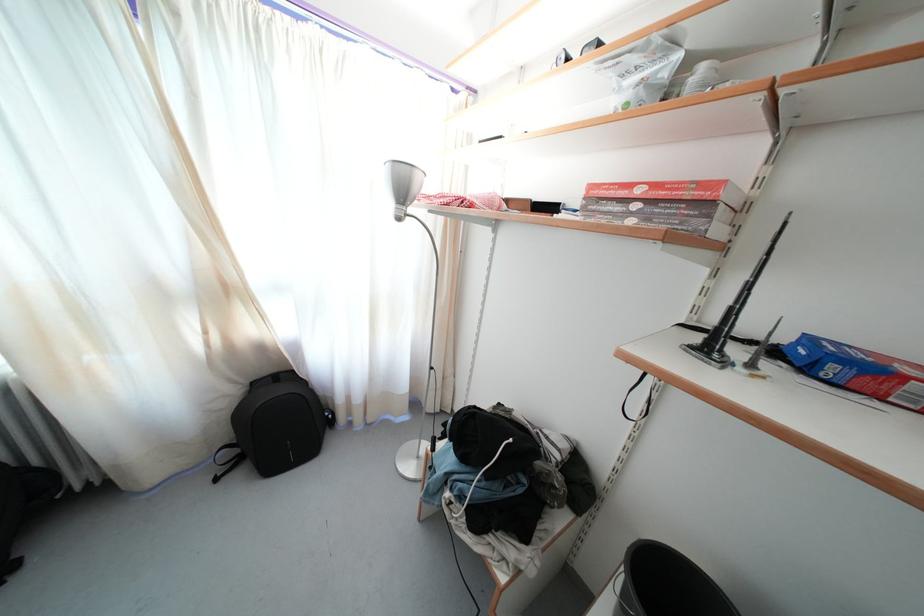
You are a GUI agent. You are given a task and a screenshot of the screen. Output one action in this format:
    pyautogui.click(x=<x>, y=<y>)
    Task: Click on the silver floor lamp
    
    Given the screenshot: What is the action you would take?
    pyautogui.click(x=412, y=300)